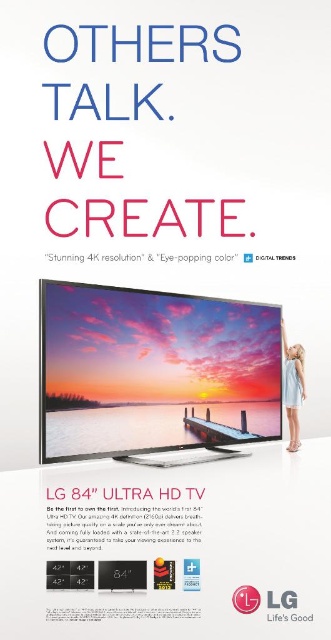
Question: Is light blue fabric dress at lower right smaller than white plastic logo at center?

Choices:
 (A) no
 (B) yes

Answer: (A)

Question: Which point is farther to the camera?

Choices:
 (A) click(x=274, y=620)
 (B) click(x=290, y=385)

Answer: (B)

Question: Considering the relative positions of light blue fabric dress at lower right and white plastic logo at center in the image provided, where is light blue fabric dress at lower right located with respect to white plastic logo at center?

Choices:
 (A) above
 (B) below

Answer: (A)

Question: Where is light blue fabric dress at lower right located in relation to white plastic logo at center in the image?

Choices:
 (A) right
 (B) left

Answer: (A)

Question: Among these objects, which one is farthest from the camera?

Choices:
 (A) light blue fabric dress at lower right
 (B) white plastic logo at center

Answer: (A)

Question: Which of the following is the closest to the observer?

Choices:
 (A) light blue fabric dress at lower right
 (B) white plastic logo at center

Answer: (B)